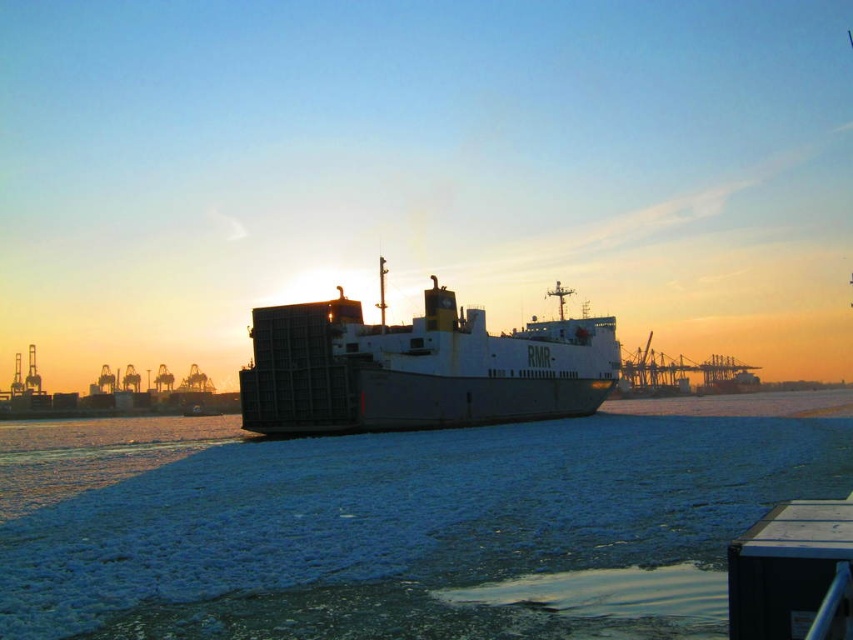
Question: Which object appears closest to the camera in this image?

Choices:
 (A) metallic gray ship at center
 (B) blue frosted water at center

Answer: (B)

Question: Is blue frosted water at center bigger than metallic gray ship at center?

Choices:
 (A) no
 (B) yes

Answer: (B)

Question: Is blue frosted water at center further to camera compared to metallic gray ship at center?

Choices:
 (A) yes
 (B) no

Answer: (B)

Question: Is blue frosted water at center to the left of metallic gray ship at center from the viewer's perspective?

Choices:
 (A) yes
 (B) no

Answer: (A)

Question: Which of the following is the farthest from the observer?

Choices:
 (A) (740, 516)
 (B) (358, 321)

Answer: (B)